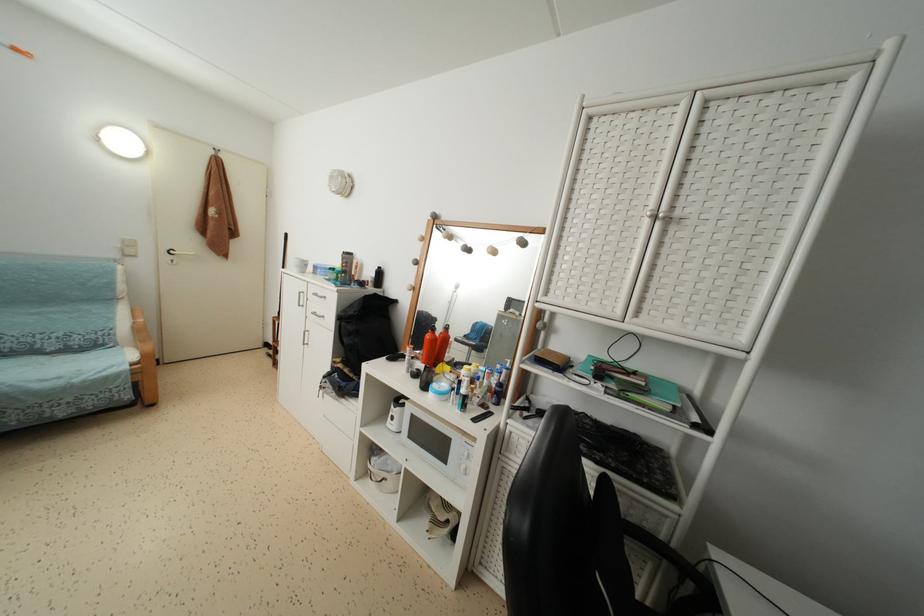
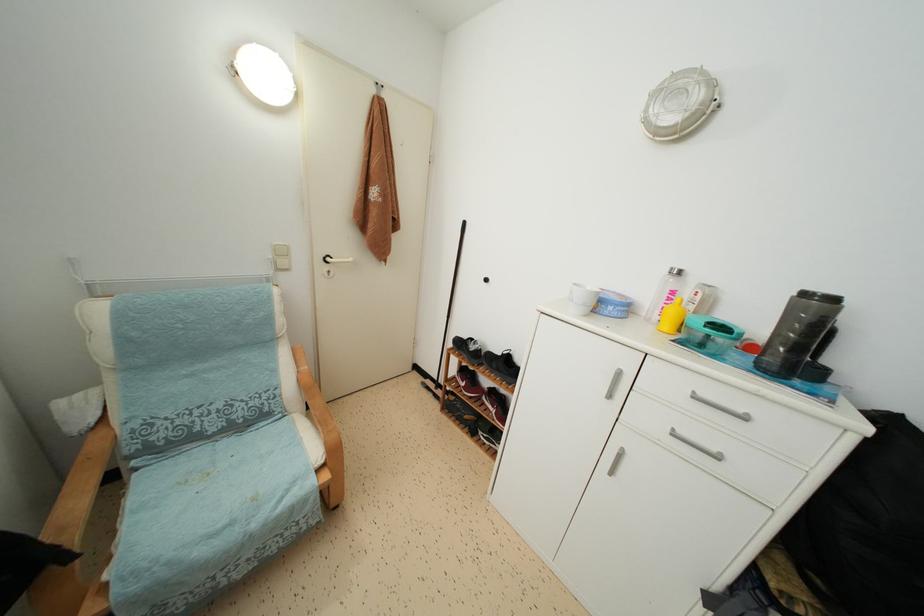
Which direction would the cameraman need to move to produce the second image?

The movement direction of the cameraman is left, forward.